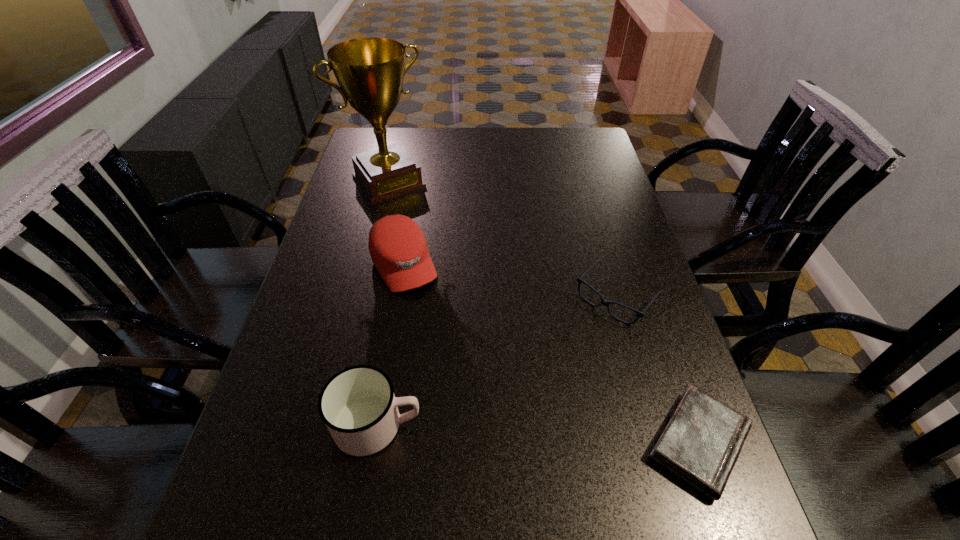
The width and height of the screenshot is (960, 540). In order to click on free region located 0.360m on the front-facing side of the fourth tallest object in this screenshot , I will do `click(499, 430)`.

Image resolution: width=960 pixels, height=540 pixels. In order to click on free region located 0.380m on the front-facing side of the cap in this screenshot , I will do `click(486, 417)`.

Identify the location of vacant area situated 0.080m on the front-facing side of the cap. The image size is (960, 540). pos(428,314).

Where is `free location located on the front-facing side of the cap`? free location located on the front-facing side of the cap is located at coordinates (486, 417).

You are a GUI agent. You are given a task and a screenshot of the screen. Output one action in this format:
    pyautogui.click(x=<x>, y=<y>)
    Task: Click on the vacant space located on the plaque of the farthest object
    
    Given the screenshot: What is the action you would take?
    pyautogui.click(x=421, y=225)

You are a GUI agent. You are given a task and a screenshot of the screen. Output one action in this format:
    pyautogui.click(x=<x>, y=<y>)
    Task: Click on the vacant point located on the plaque of the farthest object
    Image resolution: width=960 pixels, height=540 pixels.
    Given the screenshot: What is the action you would take?
    pyautogui.click(x=452, y=266)

The height and width of the screenshot is (540, 960). I want to click on vacant point located on the plaque of the farthest object, so click(411, 210).

The height and width of the screenshot is (540, 960). I want to click on object that is at the far edge, so click(370, 71).

This screenshot has height=540, width=960. Identify the location of mug at the near edge. (358, 406).

This screenshot has width=960, height=540. In order to click on diary that is at the near edge in this screenshot , I will do `click(701, 443)`.